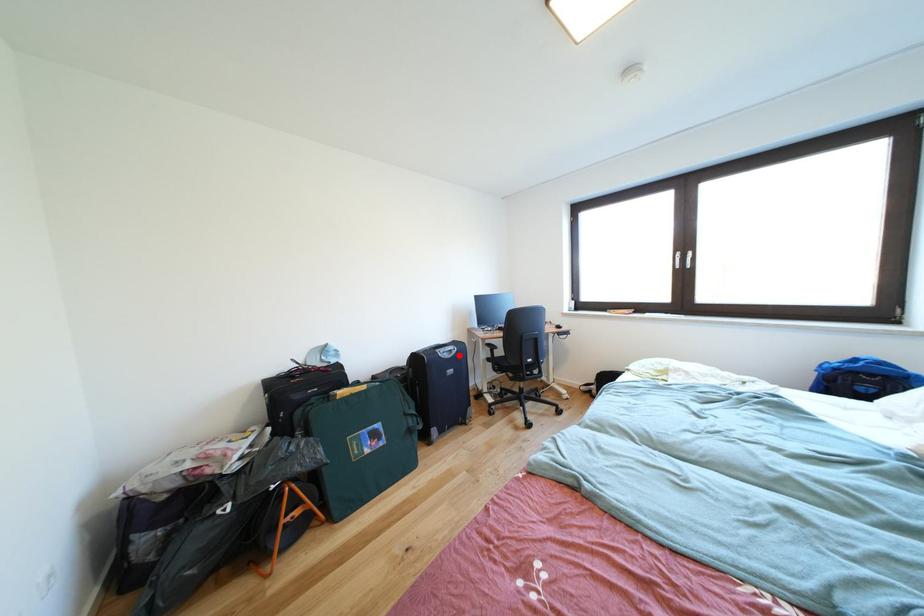
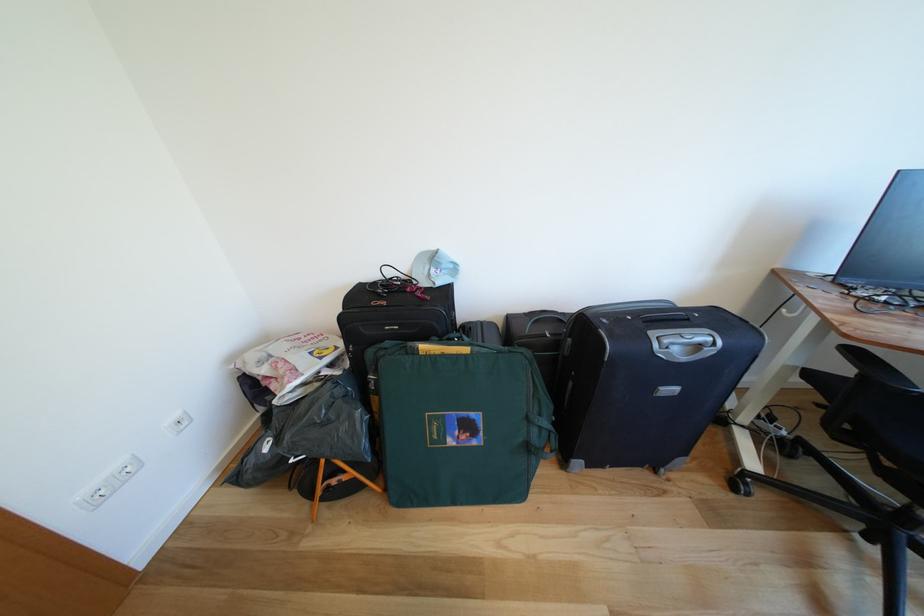
The point at the highlighted location is marked in the first image. Where is the corresponding point in the second image?

(707, 351)